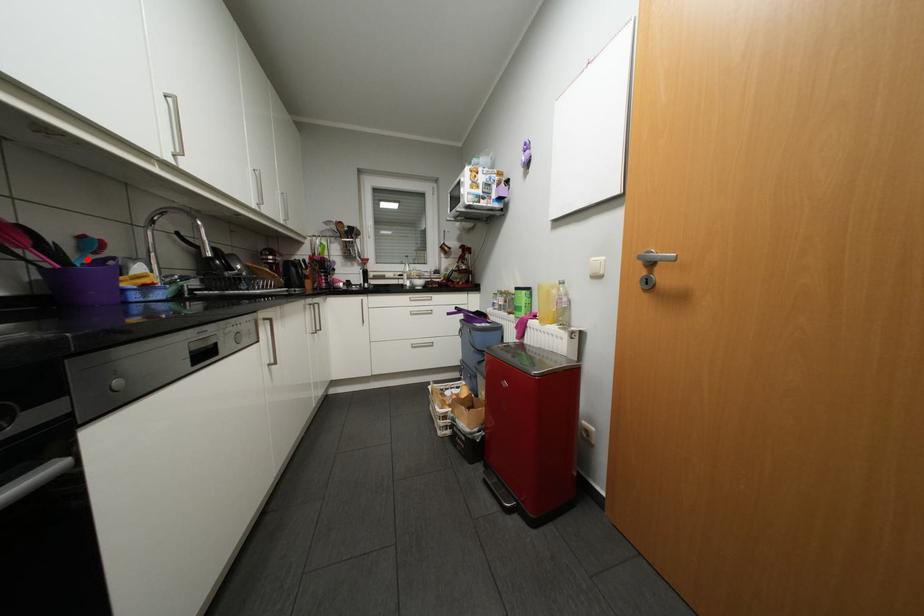
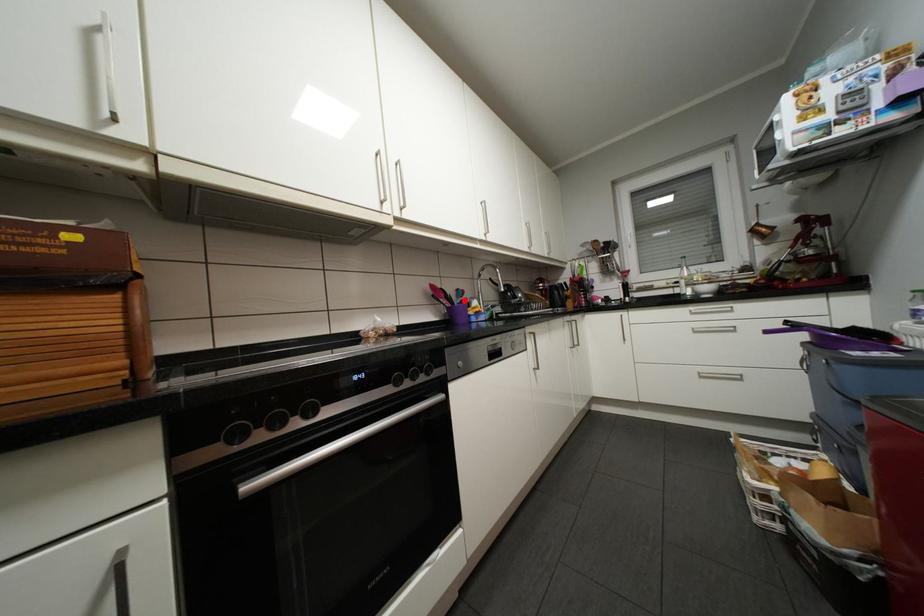
I am providing you with two images of the same scene from different viewpoints. A red point is marked on the first image and another point is marked on the second image. Is the red point in image1 aligned with the point shown in image2?

Yes